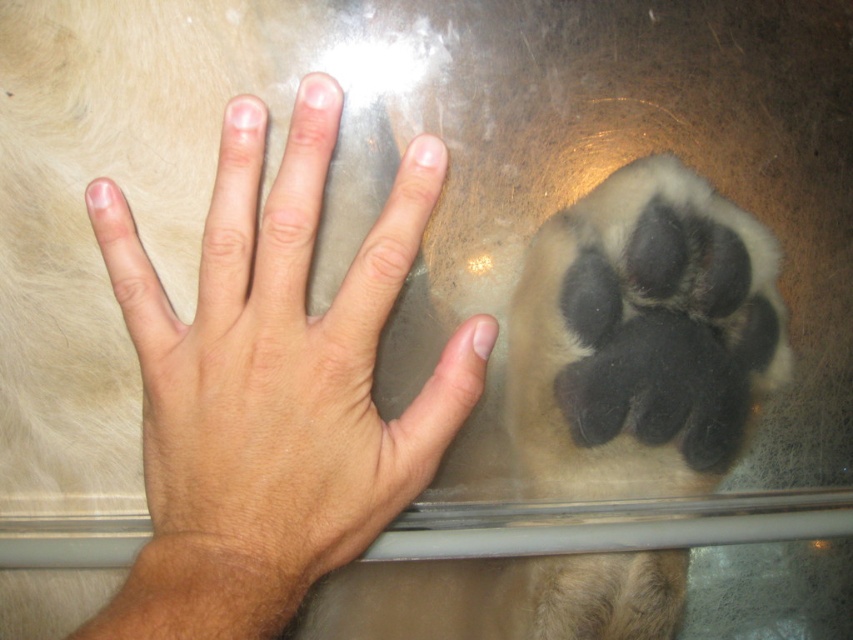
Can you confirm if light skin tone flesh at center is bigger than soft fur paw at center?

Correct, light skin tone flesh at center is larger in size than soft fur paw at center.

Measure the distance between light skin tone flesh at center and soft fur paw at center.

light skin tone flesh at center is 6.29 inches away from soft fur paw at center.

Locate an element on the screen. Image resolution: width=853 pixels, height=640 pixels. light skin tone flesh at center is located at coordinates (280, 364).